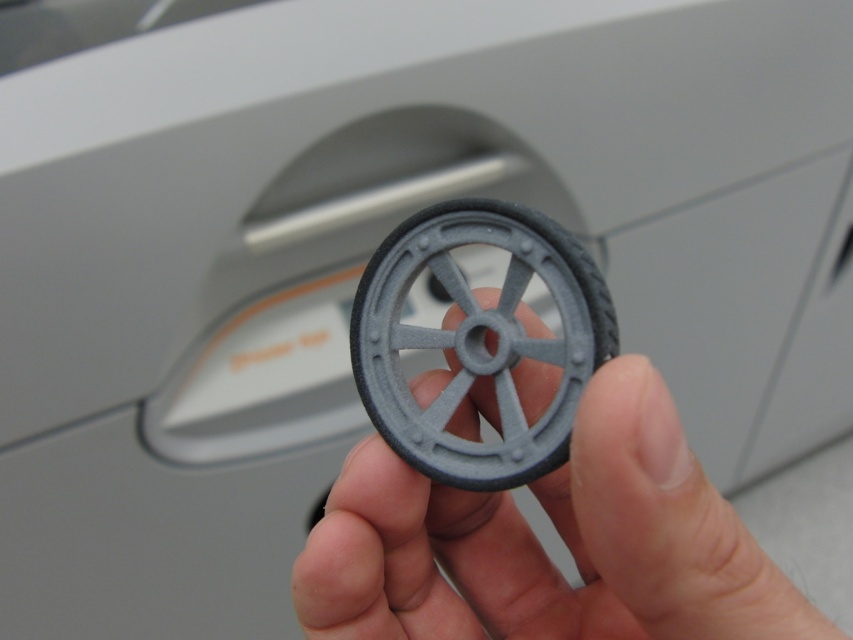
Question: Which object appears closest to the camera in this image?

Choices:
 (A) gray matte wheel at center
 (B) matte gray wheel at center

Answer: (A)

Question: Can you confirm if gray matte wheel at center is positioned to the right of matte gray wheel at center?

Choices:
 (A) no
 (B) yes

Answer: (B)

Question: Which of the following is the closest to the observer?

Choices:
 (A) matte gray wheel at center
 (B) gray matte wheel at center

Answer: (B)

Question: Does gray matte wheel at center have a lesser width compared to matte gray wheel at center?

Choices:
 (A) yes
 (B) no

Answer: (B)

Question: Can you confirm if gray matte wheel at center is positioned to the left of matte gray wheel at center?

Choices:
 (A) yes
 (B) no

Answer: (B)

Question: Which object is farther from the camera taking this photo?

Choices:
 (A) matte gray wheel at center
 (B) gray matte wheel at center

Answer: (A)